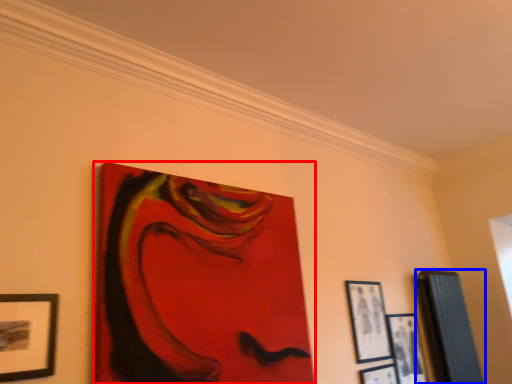
Question: Among these objects, which one is farthest to the camera, picture frame (highlighted by a red box) or picture frame (highlighted by a blue box)?

Choices:
 (A) picture frame
 (B) picture frame

Answer: (B)